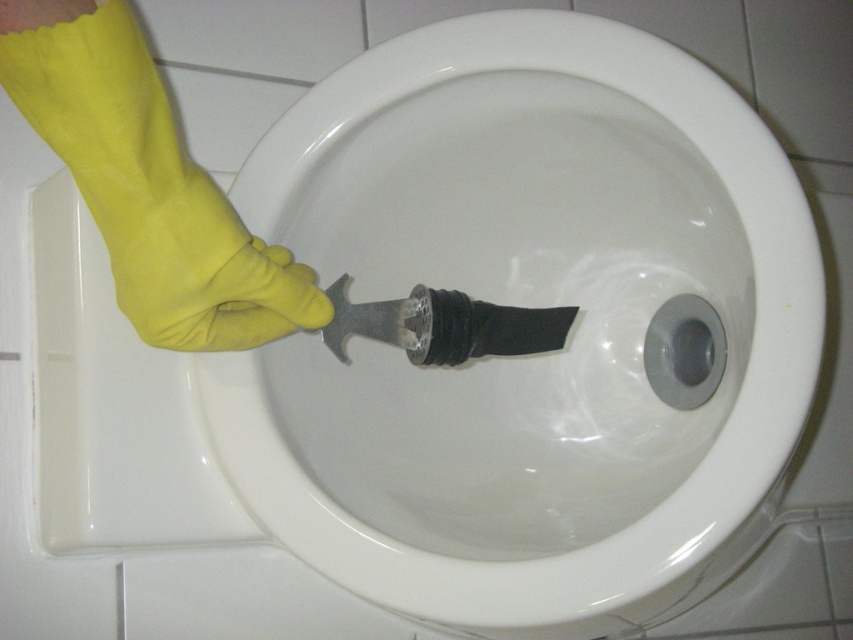
Can you confirm if yellow rubber glove at left is taller than rubber glove at center?

Result: Correct, yellow rubber glove at left is much taller as rubber glove at center.

Can you confirm if yellow rubber glove at left is shorter than rubber glove at center?

No.

Is point (70, 35) farther from viewer compared to point (213, 221)?

No, it is in front of (213, 221).

The width and height of the screenshot is (853, 640). I want to click on yellow rubber glove at left, so click(x=148, y=182).

Between white glossy toilet bowl at center and rubber glove at center, which one has less height?

rubber glove at center is shorter.

Can you confirm if white glossy toilet bowl at center is positioned to the left of rubber glove at center?

No, white glossy toilet bowl at center is not to the left of rubber glove at center.

Does point (648, 532) come farther from viewer compared to point (144, 228)?

Yes, point (648, 532) is farther from viewer.

This screenshot has width=853, height=640. Identify the location of white glossy toilet bowl at center. (512, 298).

Which is more to the right, white glossy toilet bowl at center or yellow rubber glove at left?

Positioned to the right is white glossy toilet bowl at center.

Does white glossy toilet bowl at center appear on the right side of yellow rubber glove at left?

Correct, you'll find white glossy toilet bowl at center to the right of yellow rubber glove at left.

Which is behind, point (544, 221) or point (138, 45)?

The point (544, 221) is behind.

Locate an element on the screen. This screenshot has width=853, height=640. white glossy toilet bowl at center is located at coordinates (512, 298).